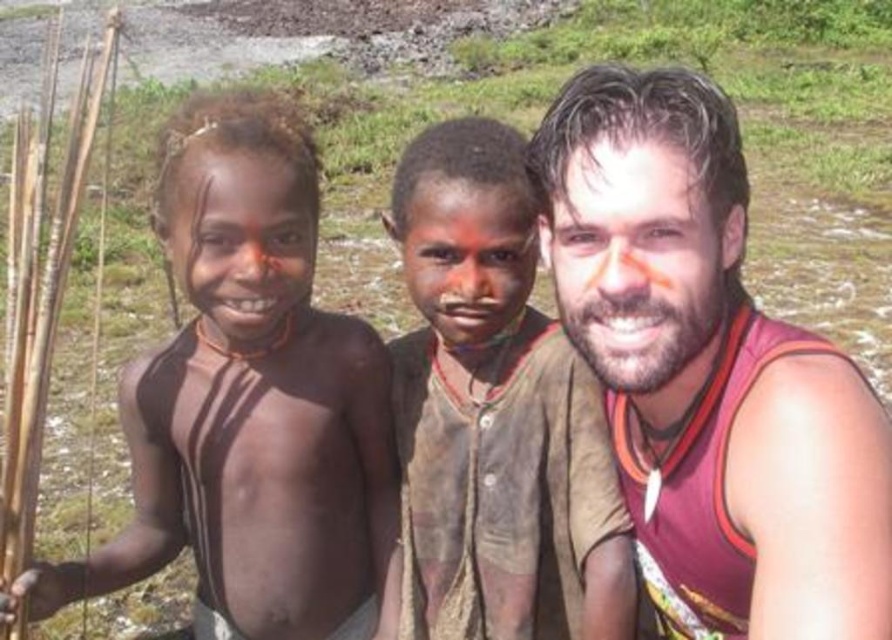
Question: Which object is the closest to the matte red tank top at right?

Choices:
 (A) brown mud face at center
 (B) brown wood reed at left

Answer: (A)

Question: Which of the following is the closest to the observer?

Choices:
 (A) brown wood reed at left
 (B) brown mud face at center
 (C) matte red tank top at right

Answer: (C)

Question: From the image, what is the correct spatial relationship of matte red tank top at right in relation to brown mud face at center?

Choices:
 (A) right
 (B) left

Answer: (A)

Question: Can you confirm if brown matte skin at left is positioned below brown mud face at center?

Choices:
 (A) no
 (B) yes

Answer: (A)

Question: Among these points, which one is farthest from the camera?

Choices:
 (A) (226, 445)
 (B) (444, 358)
 (C) (733, 307)

Answer: (B)

Question: Is brown matte skin at left behind brown mud face at center?

Choices:
 (A) no
 (B) yes

Answer: (A)